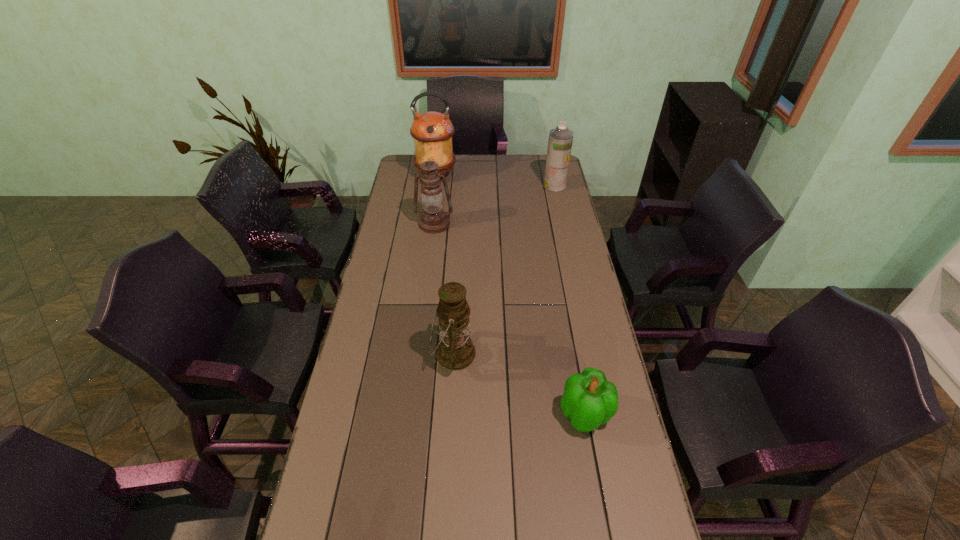
The image size is (960, 540). What are the coordinates of `vacant space located 0.120m on the left of the nearest oil lamp` in the screenshot? It's located at pyautogui.click(x=395, y=354).

At what (x,y) coordinates should I click in order to perform the action: click on vacant space located 0.090m on the left of the bell pepper. Please return your answer as a coordinate pair (x, y). Looking at the image, I should click on (527, 414).

At what (x,y) coordinates should I click in order to perform the action: click on object that is at the far edge. Please return your answer as a coordinate pair (x, y). The width and height of the screenshot is (960, 540). Looking at the image, I should click on (432, 131).

At what (x,y) coordinates should I click in order to perform the action: click on aerosol can present at the right edge. Please return your answer as a coordinate pair (x, y). The width and height of the screenshot is (960, 540). Looking at the image, I should click on (560, 141).

Where is `bell pepper present at the right edge`? The height and width of the screenshot is (540, 960). bell pepper present at the right edge is located at coordinates (590, 400).

Locate an element on the screen. Image resolution: width=960 pixels, height=540 pixels. object situated at the far left corner is located at coordinates (432, 131).

Find the location of a particular element. The height and width of the screenshot is (540, 960). vacant area at the far edge is located at coordinates (449, 173).

In the image, there is a desktop. Where is `free space at the left edge`? The width and height of the screenshot is (960, 540). free space at the left edge is located at coordinates (360, 465).

Where is `free location at the right edge of the desktop`? Image resolution: width=960 pixels, height=540 pixels. free location at the right edge of the desktop is located at coordinates (576, 288).

The height and width of the screenshot is (540, 960). Identify the location of blank region between the fourth farthest object and the aerosol can. point(504,269).